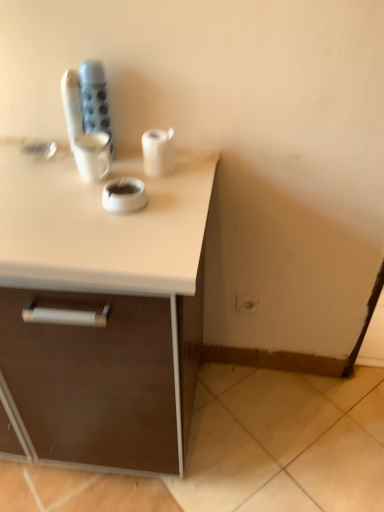
Question: Is white plastic electric outlet at lower right with white matte paper towel at center?

Choices:
 (A) no
 (B) yes

Answer: (A)

Question: Is the depth of white plastic electric outlet at lower right less than that of white matte paper towel at center?

Choices:
 (A) no
 (B) yes

Answer: (A)

Question: From the image's perspective, is white plastic electric outlet at lower right on top of white matte paper towel at center?

Choices:
 (A) no
 (B) yes

Answer: (A)

Question: Is white plastic electric outlet at lower right not near white matte paper towel at center?

Choices:
 (A) no
 (B) yes

Answer: (A)

Question: From a real-world perspective, is white plastic electric outlet at lower right below white matte paper towel at center?

Choices:
 (A) yes
 (B) no

Answer: (A)

Question: From a real-world perspective, relative to white matte paper towel at center, is white plastic electric outlet at lower right vertically above or below?

Choices:
 (A) above
 (B) below

Answer: (B)

Question: Is white plastic electric outlet at lower right spatially inside white matte paper towel at center, or outside of it?

Choices:
 (A) outside
 (B) inside

Answer: (A)

Question: Considering the positions of white plastic electric outlet at lower right and white matte paper towel at center in the image, is white plastic electric outlet at lower right wider or thinner than white matte paper towel at center?

Choices:
 (A) thin
 (B) wide

Answer: (A)

Question: From the image's perspective, relative to white matte paper towel at center, is white plastic electric outlet at lower right above or below?

Choices:
 (A) above
 (B) below

Answer: (B)

Question: Relative to white matte paper towel at center, is white matte ashtray at center in front or behind?

Choices:
 (A) behind
 (B) front

Answer: (B)

Question: Considering the positions of white matte ashtray at center and white matte paper towel at center in the image, is white matte ashtray at center taller or shorter than white matte paper towel at center?

Choices:
 (A) tall
 (B) short

Answer: (B)

Question: Considering the positions of point (110, 186) and point (167, 134), is point (110, 186) closer or farther from the camera than point (167, 134)?

Choices:
 (A) farther
 (B) closer

Answer: (B)

Question: Would you say white matte ashtray at center is to the left or to the right of white matte paper towel at center in the picture?

Choices:
 (A) right
 (B) left

Answer: (B)

Question: From a real-world perspective, is white matte paper towel at center above or below white plastic electric outlet at lower right?

Choices:
 (A) below
 (B) above

Answer: (B)

Question: Considering the positions of point (167, 163) and point (246, 302), is point (167, 163) closer or farther from the camera than point (246, 302)?

Choices:
 (A) farther
 (B) closer

Answer: (B)